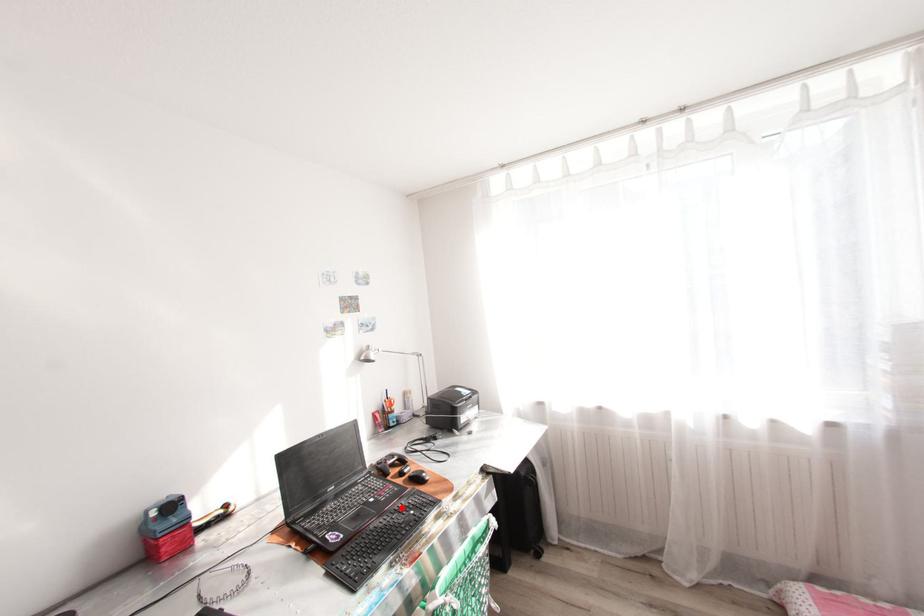
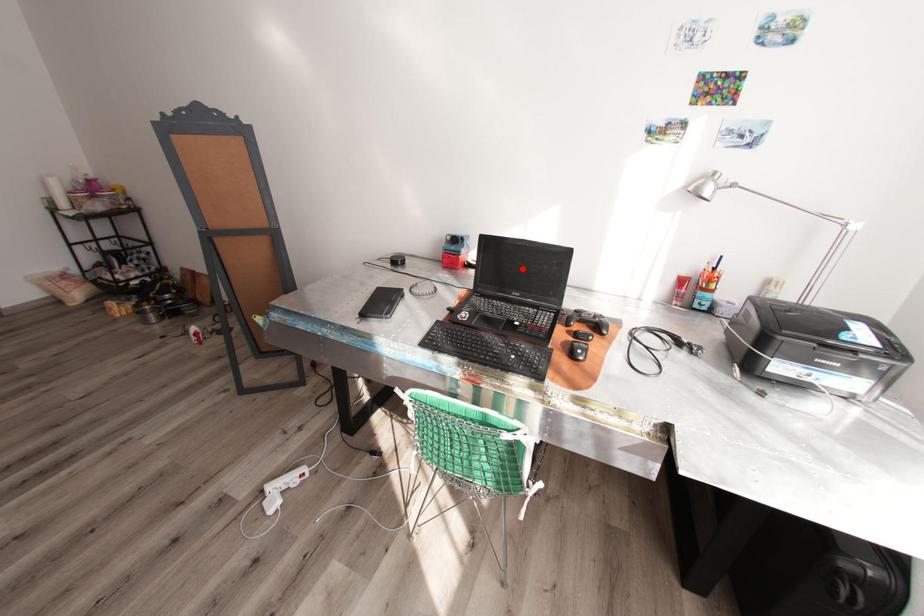
I am providing you with two images of the same scene from different viewpoints. A red point is marked on the first image and another point is marked on the second image. Are the points marked in image1 and image2 representing the same 3D position?

No